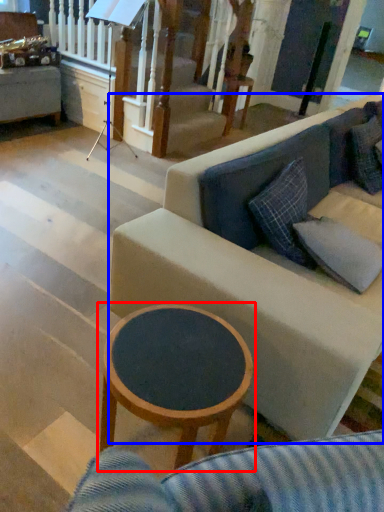
Question: Which object appears closest to the camera in this image, coffee table (highlighted by a red box) or studio couch (highlighted by a blue box)?

Choices:
 (A) coffee table
 (B) studio couch

Answer: (A)